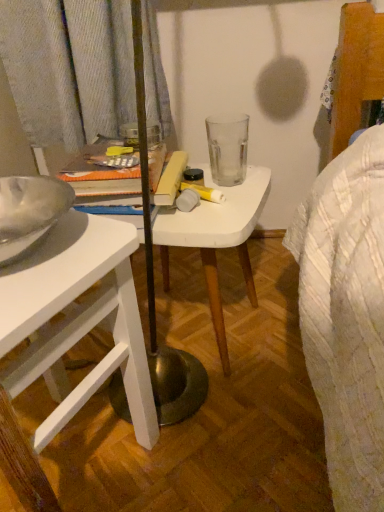
Question: Does white matte table at center have a greater width compared to white matte desk at left?

Choices:
 (A) yes
 (B) no

Answer: (B)

Question: Does white matte table at center appear on the right side of white matte desk at left?

Choices:
 (A) yes
 (B) no

Answer: (A)

Question: Considering the relative sizes of white matte table at center and white matte desk at left in the image provided, is white matte table at center thinner than white matte desk at left?

Choices:
 (A) yes
 (B) no

Answer: (A)

Question: Is white matte table at center next to white matte desk at left and touching it?

Choices:
 (A) yes
 (B) no

Answer: (B)

Question: Is white matte table at center far away from white matte desk at left?

Choices:
 (A) yes
 (B) no

Answer: (B)

Question: Is white matte table at center shorter than white matte desk at left?

Choices:
 (A) yes
 (B) no

Answer: (A)

Question: Considering the relative positions of white matte desk at left and white matte table at center in the image provided, is white matte desk at left to the right of white matte table at center from the viewer's perspective?

Choices:
 (A) yes
 (B) no

Answer: (B)

Question: Does white matte desk at left come in front of white matte table at center?

Choices:
 (A) no
 (B) yes

Answer: (B)

Question: Does white matte desk at left appear on the left side of white matte table at center?

Choices:
 (A) no
 (B) yes

Answer: (B)

Question: Can you confirm if white matte desk at left is taller than white matte table at center?

Choices:
 (A) no
 (B) yes

Answer: (B)

Question: Can you confirm if white matte desk at left is shorter than white matte table at center?

Choices:
 (A) yes
 (B) no

Answer: (B)

Question: Is white matte desk at left looking in the opposite direction of white matte table at center?

Choices:
 (A) yes
 (B) no

Answer: (B)

Question: Visually, is white matte table at center positioned to the left or to the right of white matte desk at left?

Choices:
 (A) left
 (B) right

Answer: (B)